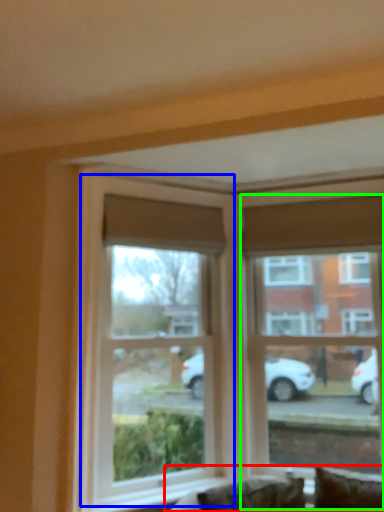
Question: Considering the real-world distances, which object is closest to couch (highlighted by a red box)? window (highlighted by a blue box) or window (highlighted by a green box).

Choices:
 (A) window
 (B) window

Answer: (A)